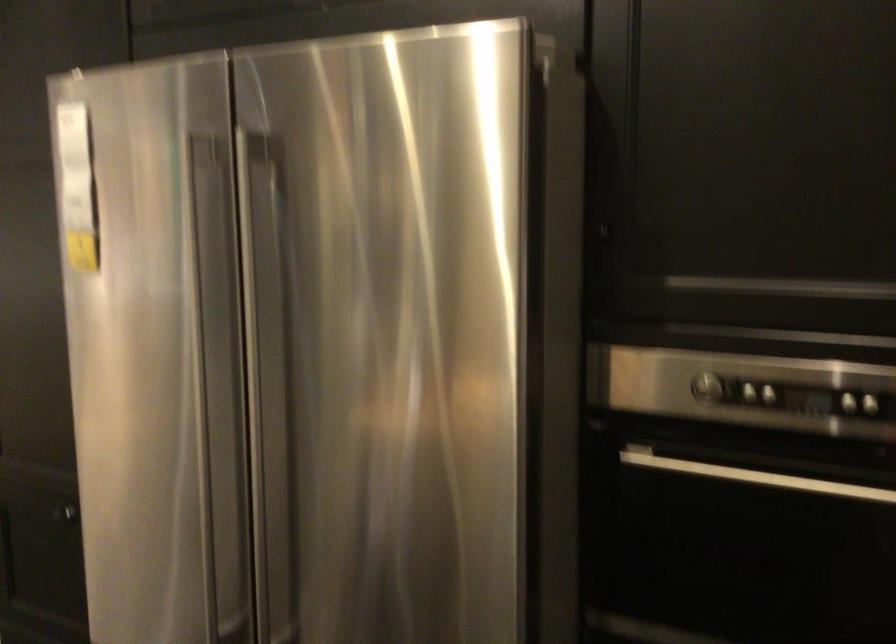
Describe the element at coordinates (703, 386) in the screenshot. I see `a oven control knob` at that location.